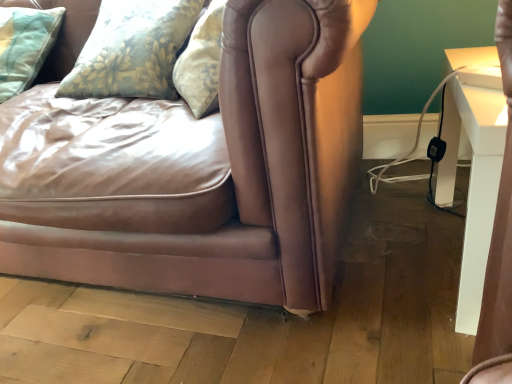
Question: From the image's perspective, would you say floral fabric pillow at upper left, which is the 1th pillow from right to left, is positioned over matte brown leather couch at center?

Choices:
 (A) yes
 (B) no

Answer: (A)

Question: Can you confirm if floral fabric pillow at upper left, arranged as the second pillow when viewed from the left, is positioned to the right of matte brown leather couch at center?

Choices:
 (A) no
 (B) yes

Answer: (B)

Question: Is floral fabric pillow at upper left, which is the 1th pillow from right to left, in contact with matte brown leather couch at center?

Choices:
 (A) no
 (B) yes

Answer: (A)

Question: From the image's perspective, is floral fabric pillow at upper left, arranged as the second pillow when viewed from the left, below matte brown leather couch at center?

Choices:
 (A) no
 (B) yes

Answer: (A)

Question: From a real-world perspective, does floral fabric pillow at upper left, which is the 1th pillow from right to left, stand above matte brown leather couch at center?

Choices:
 (A) yes
 (B) no

Answer: (A)

Question: Does point (470, 81) appear closer or farther from the camera than point (105, 0)?

Choices:
 (A) closer
 (B) farther

Answer: (A)

Question: Considering their positions, is white glossy table at right located in front of or behind floral fabric pillow at upper left, which is the 1th pillow from right to left?

Choices:
 (A) behind
 (B) front

Answer: (B)

Question: Based on their sizes in the image, would you say white glossy table at right is bigger or smaller than floral fabric pillow at upper left, which is the 1th pillow from right to left?

Choices:
 (A) small
 (B) big

Answer: (A)

Question: Is white glossy table at right situated inside floral fabric pillow at upper left, arranged as the second pillow when viewed from the left, or outside?

Choices:
 (A) outside
 (B) inside

Answer: (A)

Question: Based on their sizes in the image, would you say floral fabric pillow at upper left, arranged as the second pillow when viewed from the left, is bigger or smaller than light blue quilted pillow at upper left, acting as the first pillow starting from the left?

Choices:
 (A) small
 (B) big

Answer: (B)

Question: In terms of width, does floral fabric pillow at upper left, arranged as the second pillow when viewed from the left, look wider or thinner when compared to light blue quilted pillow at upper left, acting as the second pillow starting from the right?

Choices:
 (A) wide
 (B) thin

Answer: (A)

Question: Is point (164, 13) positioned closer to the camera than point (10, 72)?

Choices:
 (A) closer
 (B) farther

Answer: (A)

Question: In the image, is floral fabric pillow at upper left, arranged as the second pillow when viewed from the left, on the left side or the right side of light blue quilted pillow at upper left, acting as the first pillow starting from the left?

Choices:
 (A) left
 (B) right

Answer: (B)

Question: In terms of size, does floral fabric pillow at upper left, which is the 1th pillow from right to left, appear bigger or smaller than white glossy table at right?

Choices:
 (A) small
 (B) big

Answer: (B)

Question: Is floral fabric pillow at upper left, which is the 1th pillow from right to left, situated inside white glossy table at right or outside?

Choices:
 (A) inside
 (B) outside

Answer: (B)